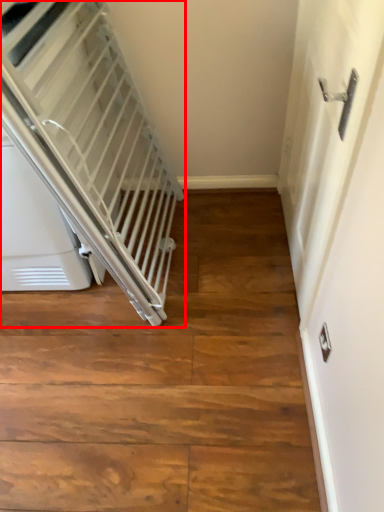
Question: From the image's perspective, what is the correct spatial relationship of escalator (annotated by the red box) in relation to door?

Choices:
 (A) above
 (B) below

Answer: (A)